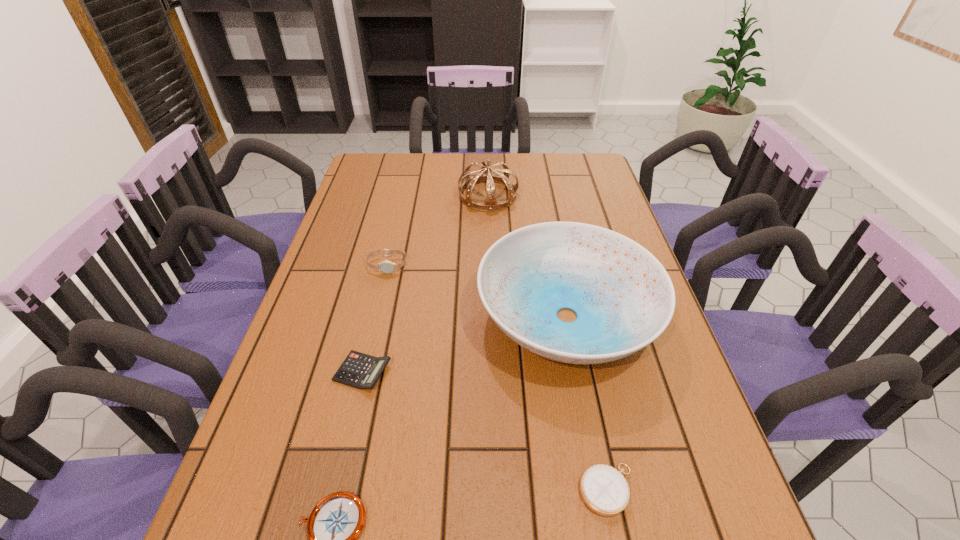
The height and width of the screenshot is (540, 960). I want to click on free space that satisfies the following two spatial constraints: 1. on the face of the calculator; 2. on the left side of the fourth shortest object, so click(363, 372).

Identify the location of free spot that satisfies the following two spatial constraints: 1. on the face of the right compass; 2. on the right side of the watch. (335, 489).

This screenshot has height=540, width=960. I want to click on blank area in the image that satisfies the following two spatial constraints: 1. on the face of the right compass; 2. on the left side of the watch, so click(x=335, y=489).